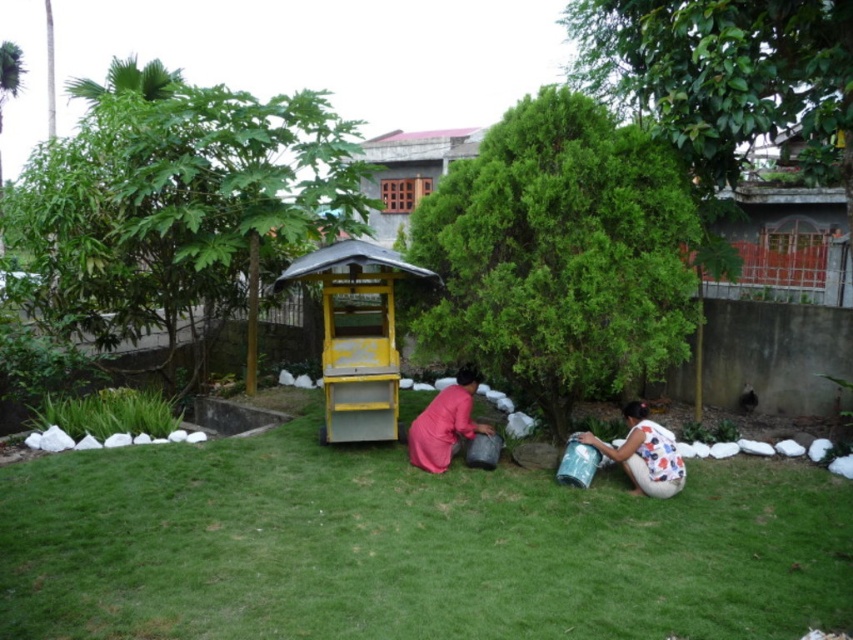
Between green leafy tree at center and yellow matte bus stop at center, which one has less height?

With less height is yellow matte bus stop at center.

Does green leafy tree at center appear on the left side of yellow matte bus stop at center?

In fact, green leafy tree at center is to the right of yellow matte bus stop at center.

Does point (552, 301) come farther from viewer compared to point (323, 276)?

No, (552, 301) is in front of (323, 276).

You are a GUI agent. You are given a task and a screenshot of the screen. Output one action in this format:
    pyautogui.click(x=<x>, y=<y>)
    Task: Click on the green leafy tree at center
    This screenshot has height=640, width=853.
    Given the screenshot: What is the action you would take?
    pyautogui.click(x=560, y=253)

The height and width of the screenshot is (640, 853). In order to click on yellow matte bus stop at center in this screenshot , I will do `click(357, 336)`.

Does yellow matte bus stop at center appear over pink matte fabric at center?

Indeed, yellow matte bus stop at center is positioned over pink matte fabric at center.

What do you see at coordinates (357, 336) in the screenshot? This screenshot has height=640, width=853. I see `yellow matte bus stop at center` at bounding box center [357, 336].

Locate an element on the screen. The height and width of the screenshot is (640, 853). yellow matte bus stop at center is located at coordinates (357, 336).

Is point (581, 576) positioned behind point (627, 436)?

No, it is in front of (627, 436).

Is green grass at center closer to camera compared to white floral dress at lower right?

Yes, green grass at center is in front of white floral dress at lower right.

Is point (608, 598) positioned behind point (659, 477)?

That is False.

The height and width of the screenshot is (640, 853). What are the coordinates of `green grass at center` in the screenshot? It's located at (409, 547).